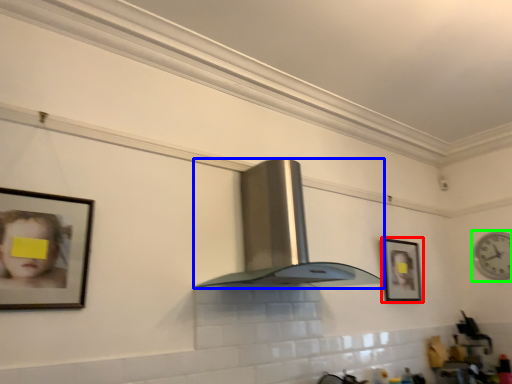
Question: Which object is positioned closest to picture frame (highlighted by a red box)? Select from fume hood (highlighted by a blue box) and clock (highlighted by a green box).

Choices:
 (A) fume hood
 (B) clock

Answer: (A)